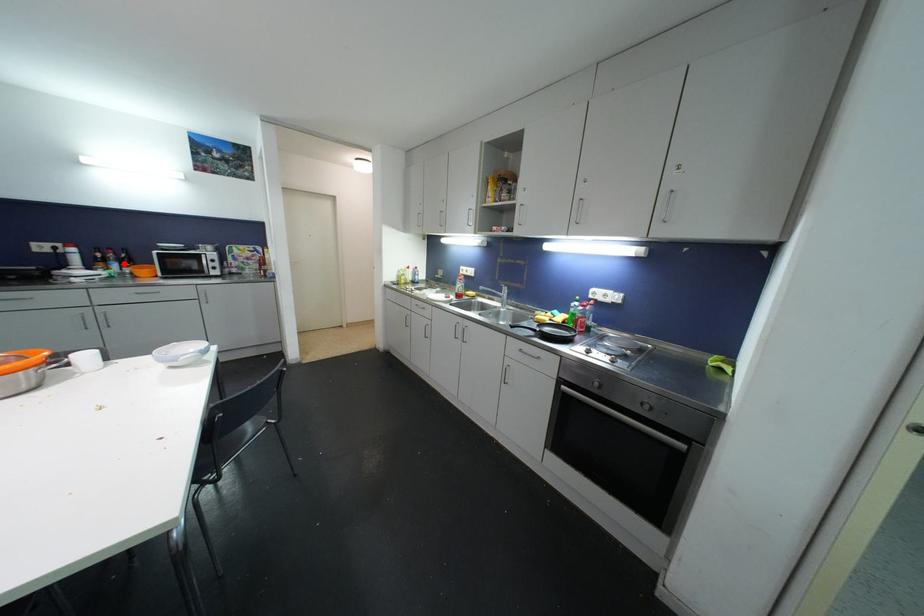
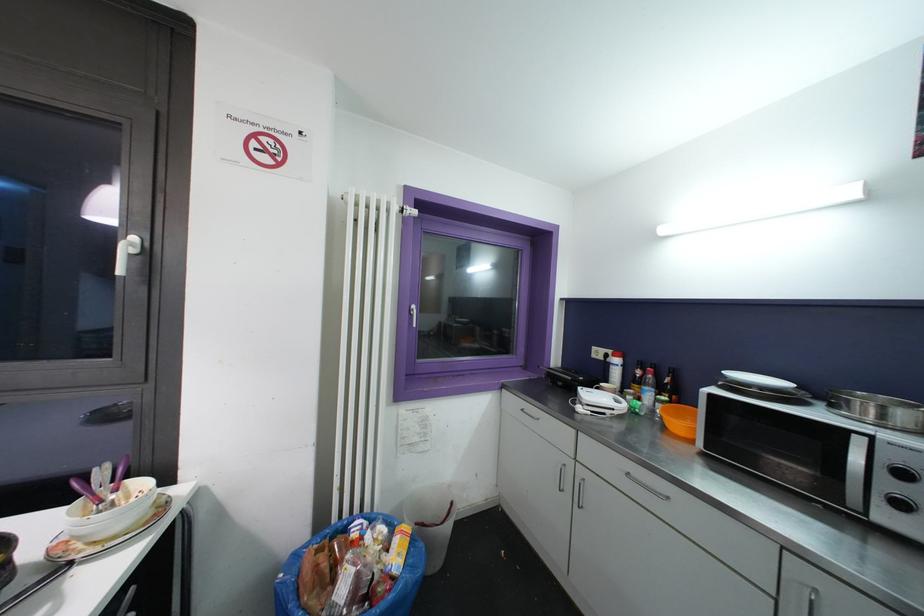
Where in the second image is the point corresponding to the highlighted location from the first image?

(663, 392)